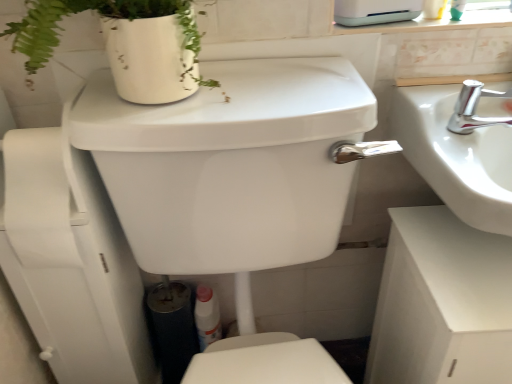
Question: From a real-world perspective, is white plastic bottle at lower center above or below white glossy appliance at upper center?

Choices:
 (A) above
 (B) below

Answer: (B)

Question: Would you say white plastic bottle at lower center is to the left or to the right of white glossy appliance at upper center in the picture?

Choices:
 (A) right
 (B) left

Answer: (B)

Question: Which is farther from the white glossy appliance at upper center?

Choices:
 (A) silver metallic faucet at upper right
 (B) white glossy sink at right
 (C) white matte cabinet at lower right
 (D) white plastic bottle at lower center

Answer: (D)

Question: Estimate the real-world distances between objects in this image. Which object is closer to the silver metallic faucet at upper right?

Choices:
 (A) white matte cabinet at lower right
 (B) white plastic bottle at lower center
 (C) white glossy sink at right
 (D) white glossy appliance at upper center

Answer: (C)